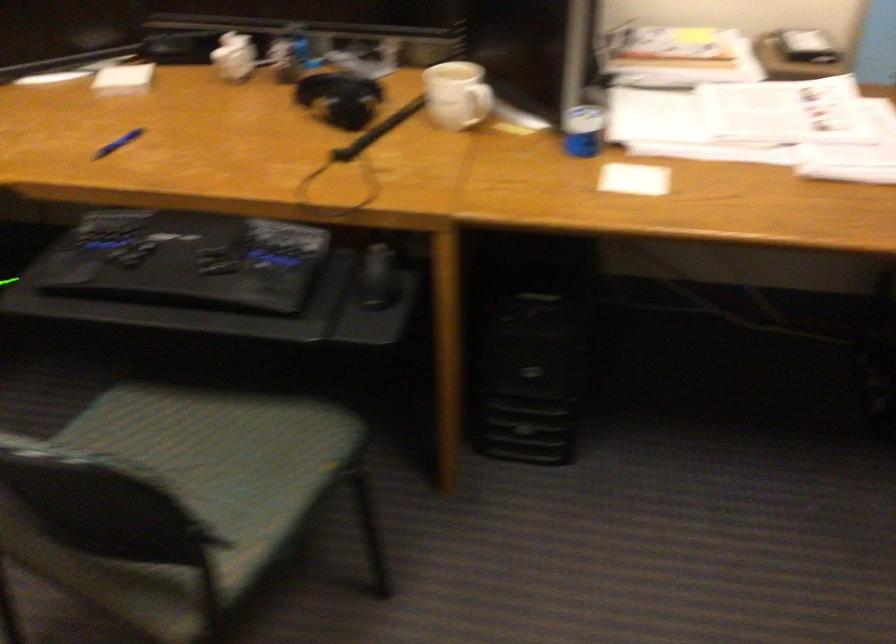
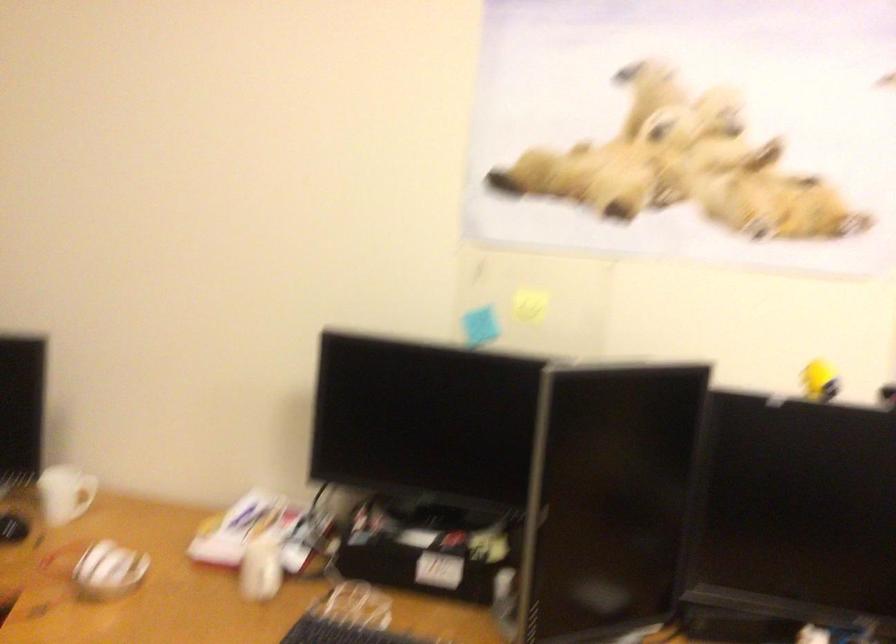
Question: Based on the continuous images, in which direction is the camera rotating? Reply with the corresponding letter.

Choices:
 (A) Left
 (B) Right
 (C) Up
 (D) Down

Answer: (C)